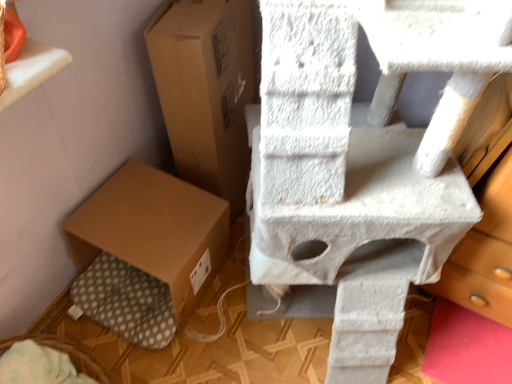
The image size is (512, 384). Find the location of `vacant area that is situated to the right of brown cardboard box at lower left, the second cardboard box in the top-to-bottom sequence`. vacant area that is situated to the right of brown cardboard box at lower left, the second cardboard box in the top-to-bottom sequence is located at coordinates (251, 319).